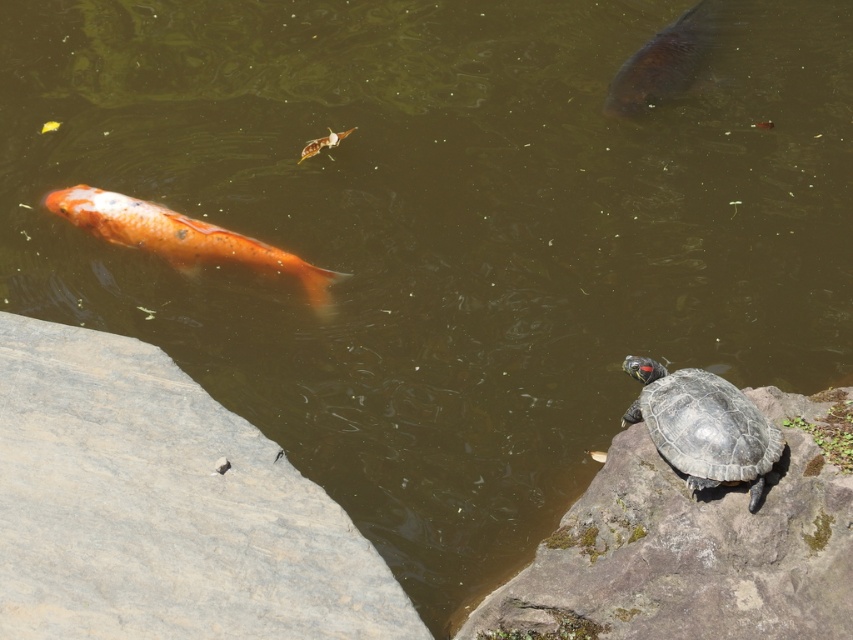
Does smooth dark gray tortoise at right have a greater width compared to shiny brown fish at upper right?

No, smooth dark gray tortoise at right is not wider than shiny brown fish at upper right.

Between point (654, 435) and point (651, 106), which one is positioned behind?

Point (651, 106)

Image resolution: width=853 pixels, height=640 pixels. I want to click on smooth dark gray tortoise at right, so click(x=703, y=426).

Does gray stone at lower left lie in front of orange matte fish at left?

Yes, it is in front of orange matte fish at left.

Does point (235, 596) come farther from viewer compared to point (125, 220)?

That is False.

Find the location of a particular element. gray stone at lower left is located at coordinates (163, 508).

Is point (664, 442) positioned behind point (225, 236)?

That is False.

Can you confirm if smooth dark gray tortoise at right is wider than orange matte fish at left?

→ No, smooth dark gray tortoise at right is not wider than orange matte fish at left.

Locate an element on the screen. This screenshot has height=640, width=853. smooth dark gray tortoise at right is located at coordinates (703, 426).